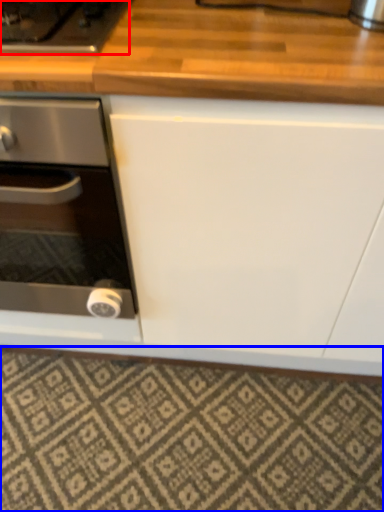
Question: Which of the following is the closest to the observer, gas stove (highlighted by a red box) or tile (highlighted by a blue box)?

Choices:
 (A) gas stove
 (B) tile

Answer: (A)